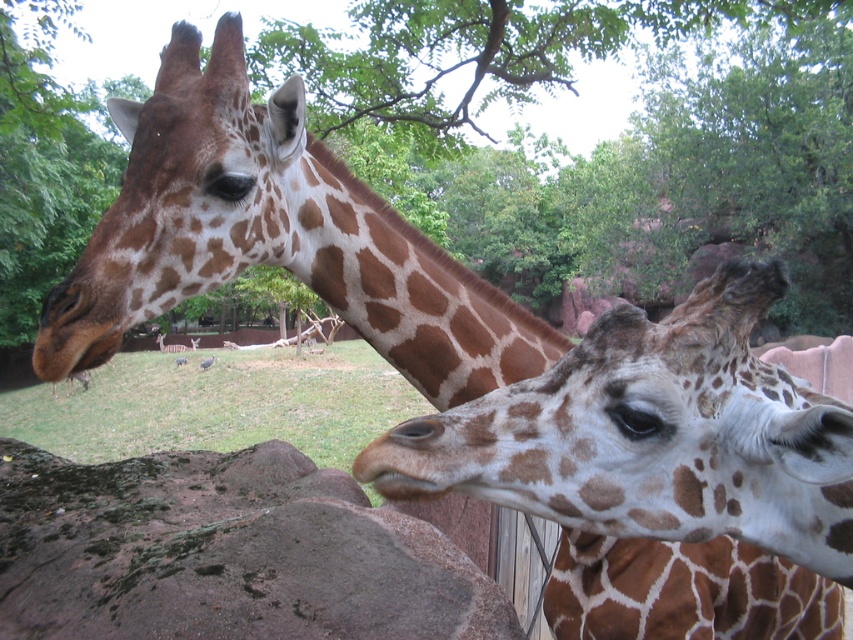
You are a zookeeper observing the giraffes. You need to determine which object takes up more area in the image between the spotted fur at center and the brown rough rock at lower left. Which one is larger?

The brown rough rock at lower left is larger because the spotted fur at center occupies less space than it.

You are a zookeeper observing two giraffes in their enclosure. You notice the spotted fur at center and the brown rough rock at lower left. Which object is closer to you, the observer?

The spotted fur at center is closer to you because it is in front of the brown rough rock at lower left.